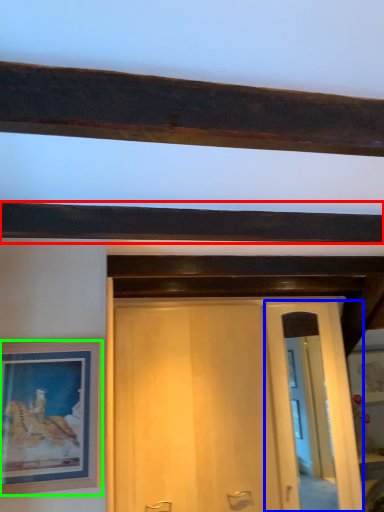
Question: Based on their relative distances, which object is nearer to plank (highlighted by a red box)? Choose from glass door (highlighted by a blue box) and picture frame (highlighted by a green box).

Choices:
 (A) glass door
 (B) picture frame

Answer: (B)